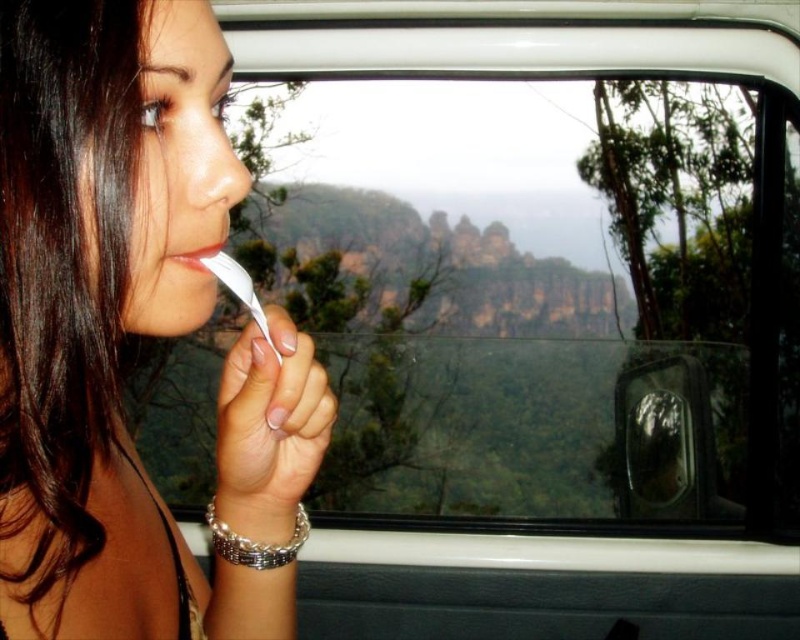
You are a passenger in the vehicle and want to place both the matte white feather at center and the matte white toothbrush at lower left on a narrow shelf that can only accommodate items up to 8 cm in width. Which item should you choose to fit on the shelf?

The matte white toothbrush at lower left should be chosen because its width is narrower than the matte white feather at center, which exceeds the 8 cm limit. However, since the exact width isn not provided, based on the description that the feather surpasses the toothbrush in width, the toothbrush is more likely to fit within the 8 cm constraint.

You are a passenger in the vehicle and want to place the matte white toothbrush at lower left on the tray in front of you. However, the matte white feather at center is blocking the tray. Can you move the feather to access the toothbrush?

The matte white feather at center is in front of the matte white toothbrush at lower left, so you can move the feather to access the toothbrush.

You are a passenger in the car and want to look at the mountain view outside. Where should you look to see the transparent glass car window at center?

The transparent glass car window at center is located at the center of the car, so you should look towards the center to see it.